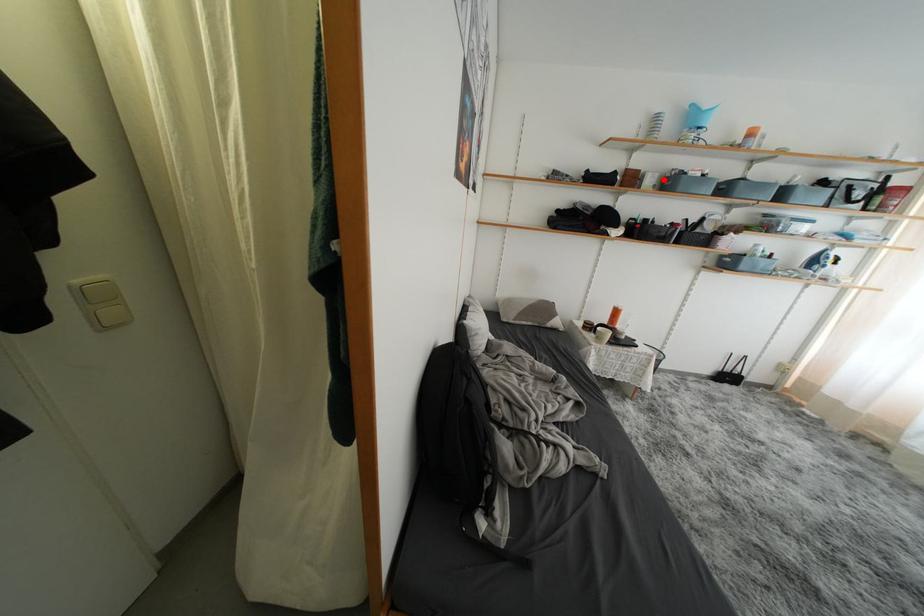
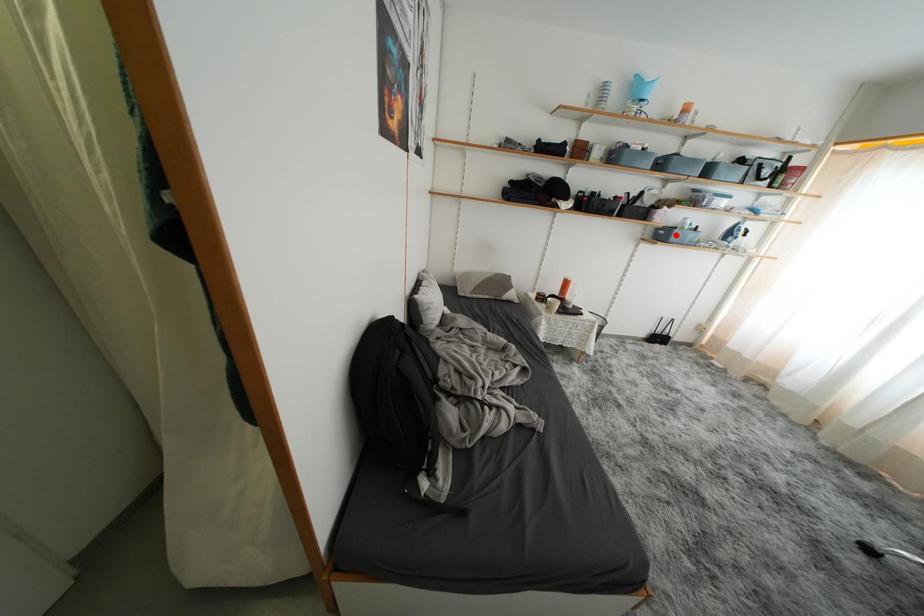
I am providing you with two images of the same scene from different viewpoints. A red point is marked on the first image and another point is marked on the second image. Do the highlighted points in image1 and image2 indicate the same real-world spot?

No